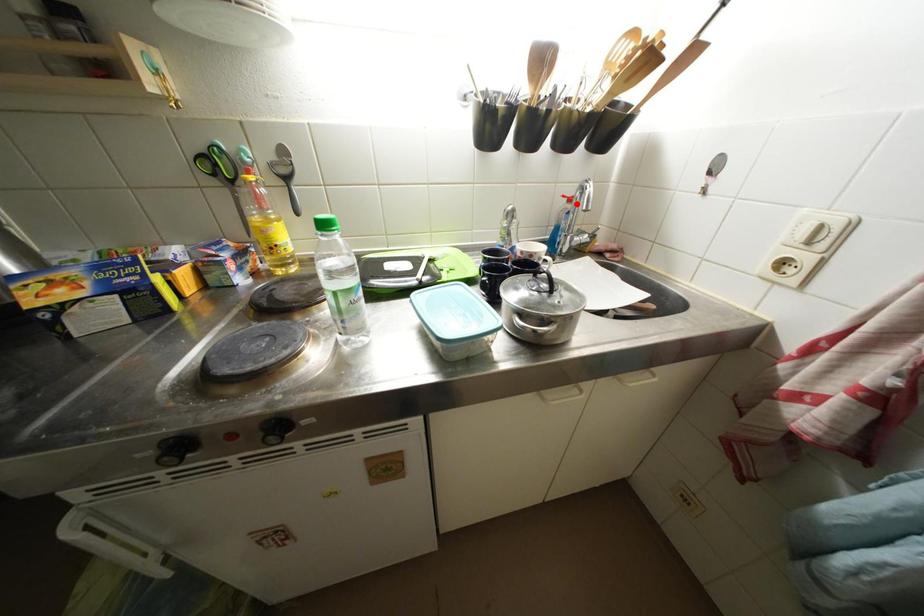
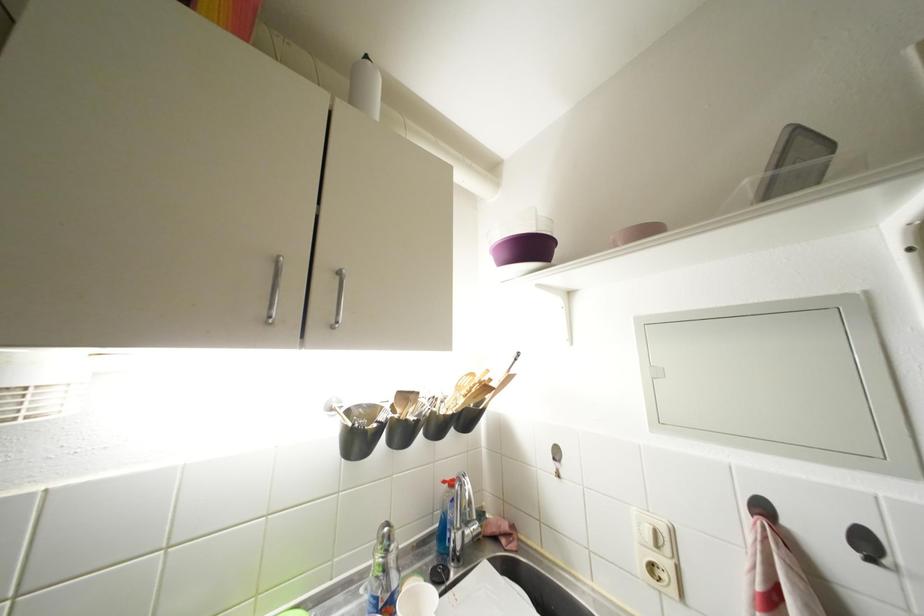
Locate, in the second image, the point that corresponds to the highlighted location in the first image.

(457, 488)